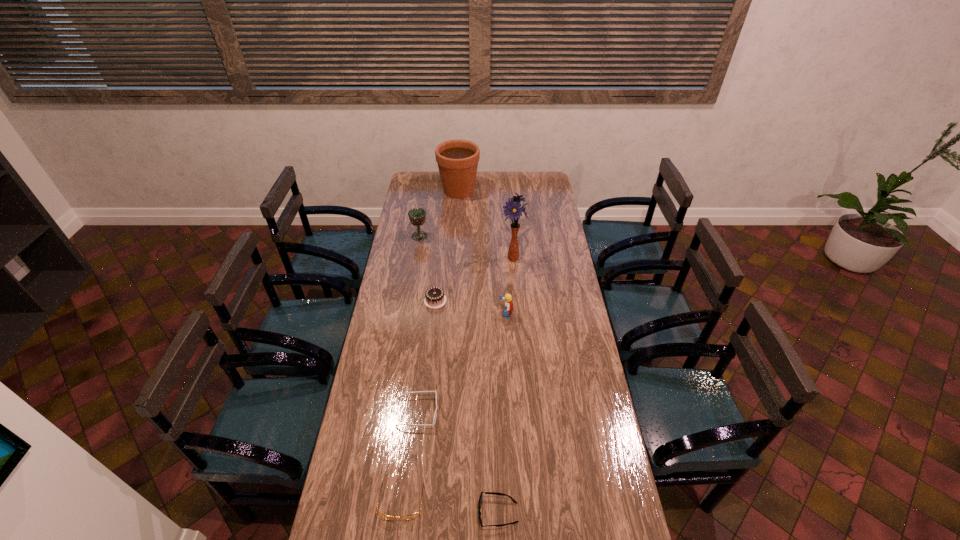
This screenshot has width=960, height=540. I want to click on vacant space at the right edge of the desktop, so click(547, 318).

In the image, there is a desktop. Where is `vacant space at the far left corner`? vacant space at the far left corner is located at coordinates (413, 189).

You are a GUI agent. You are given a task and a screenshot of the screen. Output one action in this format:
    pyautogui.click(x=<x>, y=<y>)
    Task: Click on the vacant space at the far right corner of the desktop
    Image resolution: width=960 pixels, height=540 pixels.
    Given the screenshot: What is the action you would take?
    pyautogui.click(x=528, y=175)

The height and width of the screenshot is (540, 960). I want to click on free point between the spectacles and the third tallest object, so tap(411, 369).

Locate an element on the screen. This screenshot has width=960, height=540. empty space that is in between the chocolate cake and the nearer sunglasses is located at coordinates (467, 407).

This screenshot has height=540, width=960. In order to click on free space between the chocolate cake and the fifth shortest object in this screenshot , I will do `click(470, 307)`.

Locate an element on the screen. vacant area that lies between the flowerpot and the fourth shortest object is located at coordinates (447, 246).

Identify the location of free space between the chalice and the flower arrangement. (467, 247).

Where is `free space between the fourth tallest object and the chocolate cake`? The width and height of the screenshot is (960, 540). free space between the fourth tallest object and the chocolate cake is located at coordinates (470, 307).

Locate an element on the screen. Image resolution: width=960 pixels, height=540 pixels. free space that is in between the flowerpot and the Lego is located at coordinates (483, 252).